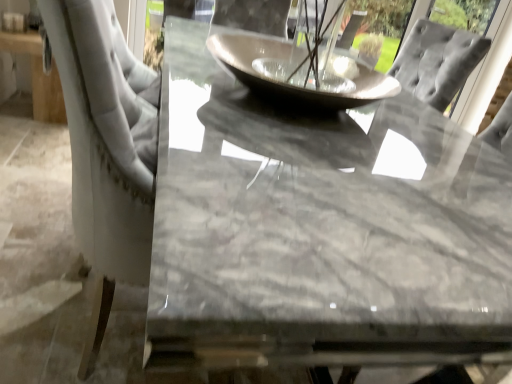
Where is `marble table at center`? This screenshot has width=512, height=384. marble table at center is located at coordinates (321, 230).

What is the approximate width of marble table at center?

marble table at center is 2.61 meters in width.

The height and width of the screenshot is (384, 512). What do you see at coordinates (321, 230) in the screenshot?
I see `marble table at center` at bounding box center [321, 230].

Measure the distance between matte gray glass bowl at center and camera.

They are 3.61 feet apart.

In order to face matte gray glass bowl at center, should I rotate leftwards or rightwards?

Rotate right and turn 6.759 degrees.

This screenshot has width=512, height=384. In order to click on matte gray glass bowl at center in this screenshot , I will do `click(289, 84)`.

The height and width of the screenshot is (384, 512). What do you see at coordinates (289, 84) in the screenshot? I see `matte gray glass bowl at center` at bounding box center [289, 84].

At what (x,y) coordinates should I click in order to perform the action: click on marble table at center. Please return your answer as a coordinate pair (x, y). The width and height of the screenshot is (512, 384). Looking at the image, I should click on (321, 230).

Is matte gray glass bowl at center at the right side of marble table at center?

In fact, matte gray glass bowl at center is to the left of marble table at center.

Between matte gray glass bowl at center and marble table at center, which one is positioned in front?

marble table at center.

Considering the points (254, 70) and (267, 311), which point is behind, point (254, 70) or point (267, 311)?

Point (254, 70)

From the image's perspective, is matte gray glass bowl at center above marble table at center?

Indeed, from the image's perspective, matte gray glass bowl at center is shown above marble table at center.

From a real-world perspective, which is physically above, matte gray glass bowl at center or marble table at center?

In real-world perspective, matte gray glass bowl at center is above.

Between matte gray glass bowl at center and marble table at center, which one has larger width?

marble table at center.

Looking at this image, does matte gray glass bowl at center have a greater height compared to marble table at center?

Correct, matte gray glass bowl at center is much taller as marble table at center.

Who is smaller, matte gray glass bowl at center or marble table at center?

Smaller between the two is matte gray glass bowl at center.

Is marble table at center completely or partially inside matte gray glass bowl at center?

No, marble table at center is not inside matte gray glass bowl at center.

Does matte gray glass bowl at center touch marble table at center?

matte gray glass bowl at center and marble table at center are not in contact.

Does matte gray glass bowl at center turn towards marble table at center?

No, matte gray glass bowl at center does not turn towards marble table at center.

What's the angular difference between matte gray glass bowl at center and marble table at center's facing directions?

matte gray glass bowl at center and marble table at center are facing 90.1 degrees away from each other.

The height and width of the screenshot is (384, 512). What are the coordinates of `table lying in front of the matte gray glass bowl at center` in the screenshot? It's located at (321, 230).

Would you say marble table at center is to the left or to the right of matte gray glass bowl at center in the picture?

Clearly, marble table at center is on the right of matte gray glass bowl at center in the image.

Is the position of marble table at center more distant than that of matte gray glass bowl at center?

No, the depth of marble table at center is less than that of matte gray glass bowl at center.

Which point is more forward, (165, 187) or (229, 36)?

The point (165, 187) is more forward.

From the image's perspective, is marble table at center located above or below matte gray glass bowl at center?

From the image's perspective, marble table at center appears below matte gray glass bowl at center.

From a real-world perspective, who is located higher, marble table at center or matte gray glass bowl at center?

From a 3D spatial view, matte gray glass bowl at center is above.

In terms of width, does marble table at center look wider or thinner when compared to matte gray glass bowl at center?

marble table at center is wider than matte gray glass bowl at center.

Does marble table at center have a greater height compared to matte gray glass bowl at center?

No.

Can you confirm if marble table at center is smaller than matte gray glass bowl at center?

No.

Is marble table at center situated inside matte gray glass bowl at center or outside?

marble table at center lies outside matte gray glass bowl at center.

Is marble table at center beside matte gray glass bowl at center?

They are not placed beside each other.

Is marble table at center positioned with its back to matte gray glass bowl at center?

No, matte gray glass bowl at center is not at the back of marble table at center.

Find the location of a particular element. The width and height of the screenshot is (512, 384). glass bowl behind the marble table at center is located at coordinates (289, 84).

Identify the location of glass bowl that is on the left side of marble table at center. Image resolution: width=512 pixels, height=384 pixels. (289, 84).

Find the location of `table located below the matte gray glass bowl at center (from the image's perspective)`. table located below the matte gray glass bowl at center (from the image's perspective) is located at coordinates 321,230.